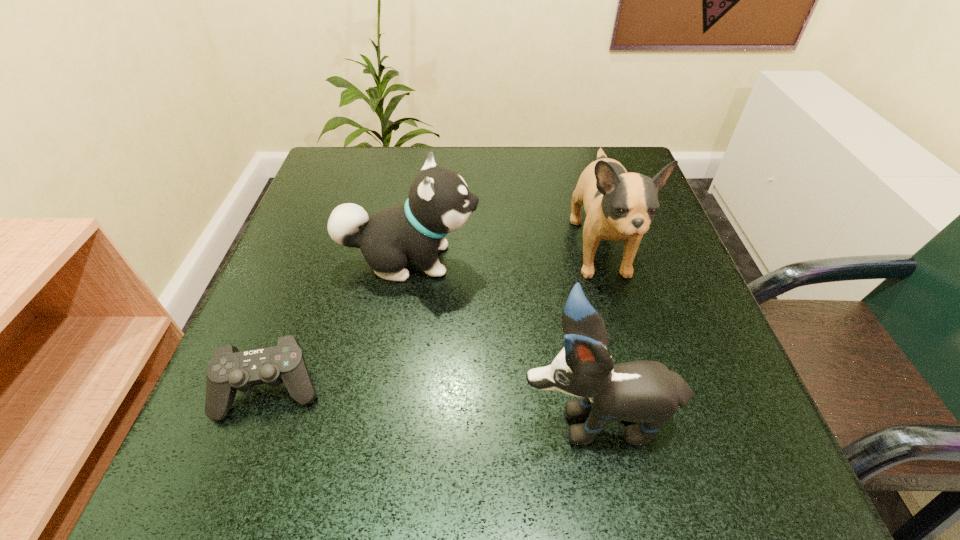
This screenshot has height=540, width=960. Identify the location of vacant space that is in between the nearest puppy and the control. (434, 403).

Identify which object is the third closest to the control. Please provide its 2D coordinates. Your answer should be formatted as a tuple, i.e. [(x, y)], where the tuple contains the x and y coordinates of a point satisfying the conditions above.

[(619, 205)]

At what (x,y) coordinates should I click in order to perform the action: click on the third closest object to the nearest puppy. Please return your answer as a coordinate pair (x, y). Looking at the image, I should click on (229, 370).

The height and width of the screenshot is (540, 960). Identify the location of the closest puppy to the leftmost puppy. (619, 205).

This screenshot has height=540, width=960. Find the location of `the third closest puppy relative to the control`. the third closest puppy relative to the control is located at coordinates (619, 205).

At what (x,y) coordinates should I click in order to perform the action: click on free space that satisfies the following two spatial constraints: 1. at the face of the leftmost puppy; 2. on the front side of the control. Please return your answer as a coordinate pair (x, y). The height and width of the screenshot is (540, 960). Looking at the image, I should click on (388, 388).